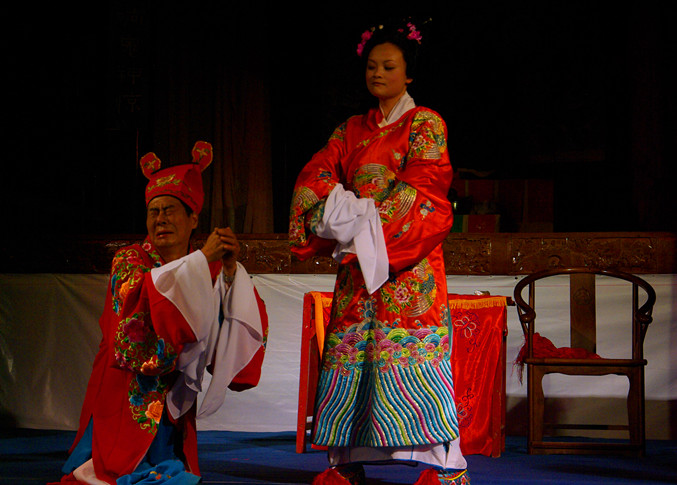
In order to click on red tablecloth in this screenshot , I will do `click(494, 336)`.